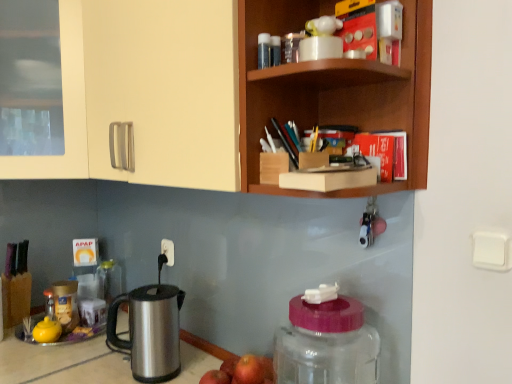
Question: Is transparent plastic bottle at upper center, placed as the first bottle when sorted from top to bottom, wider or thinner than matte cream cabinet at upper left?

Choices:
 (A) thin
 (B) wide

Answer: (A)

Question: From the image's perspective, relative to matte cream cabinet at upper left, is transparent plastic bottle at upper center, positioned as the second bottle in left-to-right order, above or below?

Choices:
 (A) above
 (B) below

Answer: (B)

Question: Which of these objects is positioned closest to the transparent plastic bottle at lower right, which is the 3th bottle from left to right?

Choices:
 (A) red matte apple at lower center
 (B) white plastic electric outlet at center
 (C) white plastic light switch at upper right
 (D) metallic silver jar at left, marked as the 1th bottle in a bottom-to-top arrangement
 (E) stainless steel kettle at lower left

Answer: (A)

Question: Which object is the farthest from the white plastic light switch at upper right?

Choices:
 (A) white plastic electric outlet at center
 (B) metallic silver jar at left, marked as the 1th bottle in a bottom-to-top arrangement
 (C) matte cream cabinet at upper left
 (D) transparent plastic bottle at lower right, the 2th bottle positioned from the bottom
 (E) stainless steel kettle at lower left

Answer: (B)